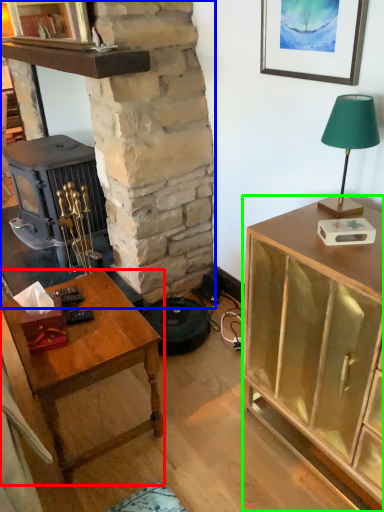
Question: Which object is the closest to the desk (highlighted by a red box)? Choose among these: fireplace (highlighted by a blue box) or cabinetry (highlighted by a green box).

Choices:
 (A) fireplace
 (B) cabinetry

Answer: (B)